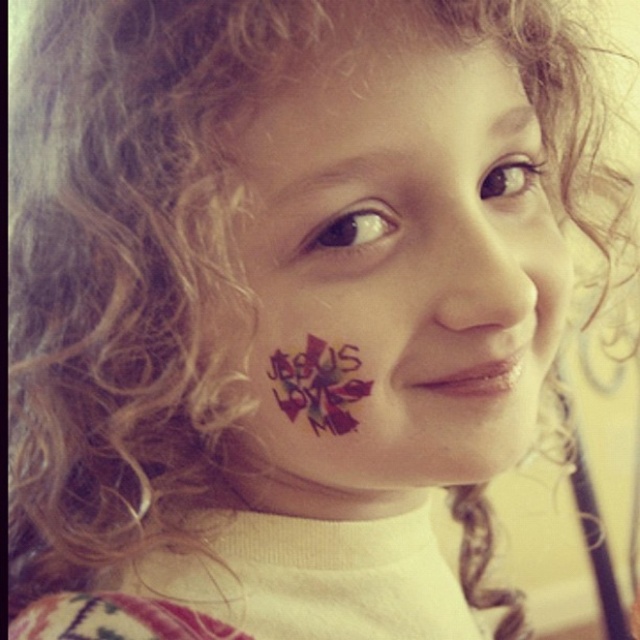
Is point (266, 120) positioned behind point (310, 396)?

No, it is not.

Does dark red matte text at cheek center have a greater height compared to multicolored painted flower at center?

Yes.

Which is in front, point (426, 72) or point (328, 376)?

Point (426, 72) is in front.

Find the location of a particular element. This screenshot has width=640, height=640. dark red matte text at cheek center is located at coordinates (397, 268).

Can you confirm if dark red matte text at cheek center is bigger than matte skin nose at center?

Correct, dark red matte text at cheek center is larger in size than matte skin nose at center.

Between dark red matte text at cheek center and matte skin nose at center, which one has less height?

With less height is matte skin nose at center.

Is point (400, 323) in front of point (508, 205)?

Yes, point (400, 323) is in front of point (508, 205).

Find the location of `dark red matte text at cheek center`. dark red matte text at cheek center is located at coordinates (397, 268).

Which is in front, point (492, 298) or point (298, 403)?

Point (492, 298) is in front.

Can you confirm if matte skin nose at center is positioned to the left of multicolored painted flower at center?

No, matte skin nose at center is not to the left of multicolored painted flower at center.

What do you see at coordinates (492, 257) in the screenshot? This screenshot has width=640, height=640. I see `matte skin nose at center` at bounding box center [492, 257].

At what (x,y) coordinates should I click in order to perform the action: click on matte skin nose at center. Please return your answer as a coordinate pair (x, y). The height and width of the screenshot is (640, 640). Looking at the image, I should click on (492, 257).